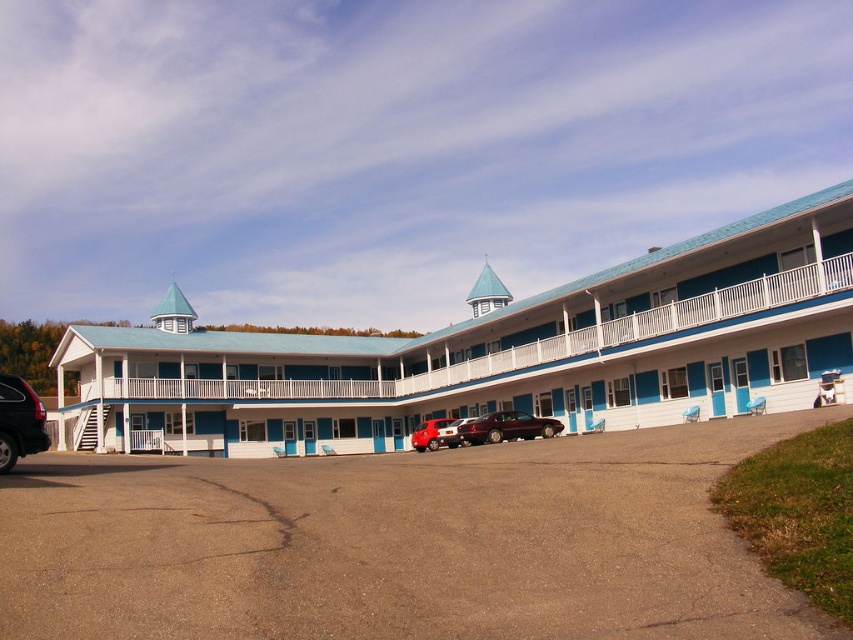
Does shiny maroon sedan at center have a larger size compared to metallic silver van at center?

Incorrect, shiny maroon sedan at center is not larger than metallic silver van at center.

Can you confirm if shiny maroon sedan at center is thinner than metallic silver van at center?

Yes, shiny maroon sedan at center is thinner than metallic silver van at center.

This screenshot has height=640, width=853. I want to click on shiny maroon sedan at center, so click(x=506, y=428).

Between asphalt at lower center and shiny maroon sedan at center, which one has less height?

shiny maroon sedan at center

Who is taller, asphalt at lower center or shiny maroon sedan at center?

With more height is asphalt at lower center.

Where is `asphalt at lower center`? asphalt at lower center is located at coordinates (399, 544).

Which of these two, asphalt at lower center or metallic silver van at center, stands taller?

asphalt at lower center

Is asphalt at lower center above metallic silver van at center?

Yes, asphalt at lower center is above metallic silver van at center.

Which is in front, point (225, 593) or point (433, 442)?

Positioned in front is point (225, 593).

At what (x,y) coordinates should I click in order to perform the action: click on asphalt at lower center. Please return your answer as a coordinate pair (x, y). This screenshot has height=640, width=853. Looking at the image, I should click on (399, 544).